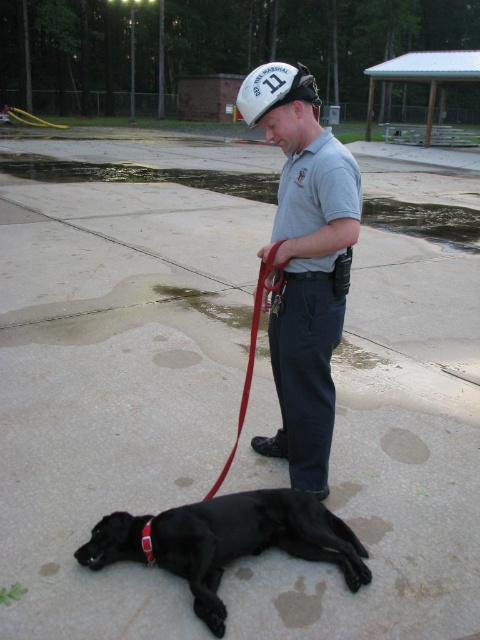
Question: Considering the relative positions of gray matte uniform at center and white matte baseball cap at center in the image provided, where is gray matte uniform at center located with respect to white matte baseball cap at center?

Choices:
 (A) below
 (B) above

Answer: (A)

Question: Among these points, which one is farthest from the camera?

Choices:
 (A) (277, 61)
 (B) (248, 369)
 (C) (311, 179)
 (D) (352, 534)

Answer: (A)

Question: Which object is the farthest from the black smooth dog at lower center?

Choices:
 (A) white matte baseball cap at center
 (B) red leather leash at center
 (C) gray matte uniform at center

Answer: (A)

Question: Can you confirm if gray matte uniform at center is positioned to the right of red leather leash at center?

Choices:
 (A) no
 (B) yes

Answer: (B)

Question: Estimate the real-world distances between objects in this image. Which object is farther from the red leather leash at center?

Choices:
 (A) white matte baseball cap at center
 (B) black smooth dog at lower center

Answer: (A)

Question: Can you confirm if black smooth dog at lower center is positioned below white matte baseball cap at center?

Choices:
 (A) no
 (B) yes

Answer: (B)